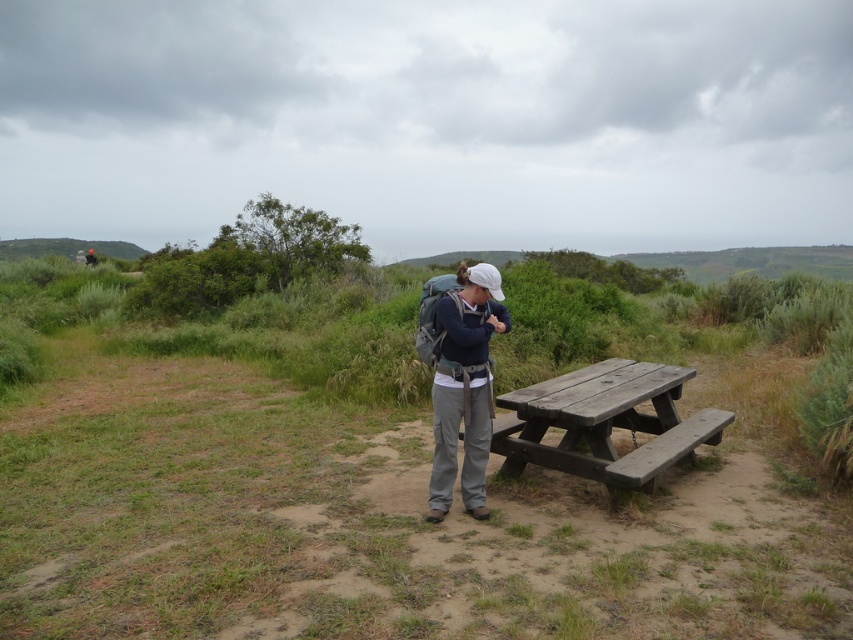
Question: Can you confirm if green grassy at center is positioned above matte gray backpack at center?

Choices:
 (A) no
 (B) yes

Answer: (B)

Question: Which point appears closest to the camera in this image?

Choices:
 (A) (339, 566)
 (B) (589, 417)
 (C) (473, 285)

Answer: (A)

Question: Can you confirm if green grassy at center is bigger than weathered wood picnic table at center?

Choices:
 (A) yes
 (B) no

Answer: (A)

Question: Among these points, which one is farthest from the camera?

Choices:
 (A) (637, 449)
 (B) (569, 292)
 (C) (471, 509)

Answer: (B)

Question: Can you confirm if green grassy at center is positioned to the left of matte gray backpack at center?

Choices:
 (A) yes
 (B) no

Answer: (A)

Question: Which is farther from the green grassy at center?

Choices:
 (A) matte gray backpack at center
 (B) weathered wood picnic table at center

Answer: (A)